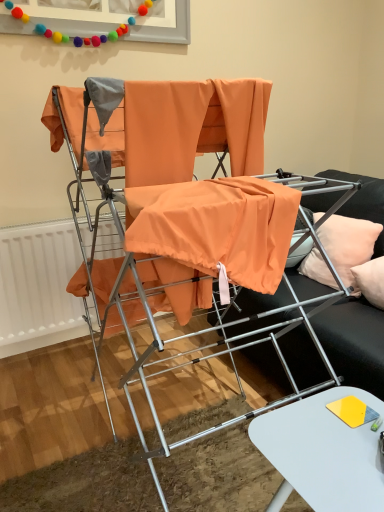
This screenshot has width=384, height=512. I want to click on free location above white glossy table at lower right (from a real-world perspective), so (x=328, y=439).